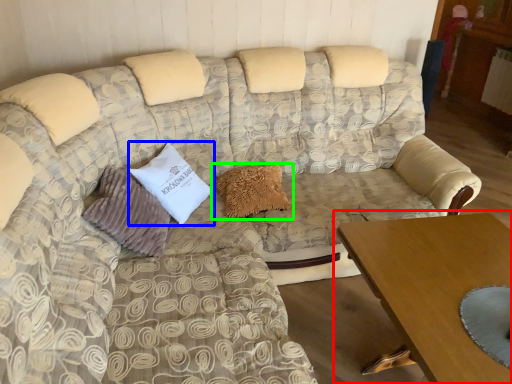
Question: Which object is positioned closest to table (highlighted by a red box)? Select from pillow (highlighted by a blue box) and pillow (highlighted by a green box).

Choices:
 (A) pillow
 (B) pillow

Answer: (B)